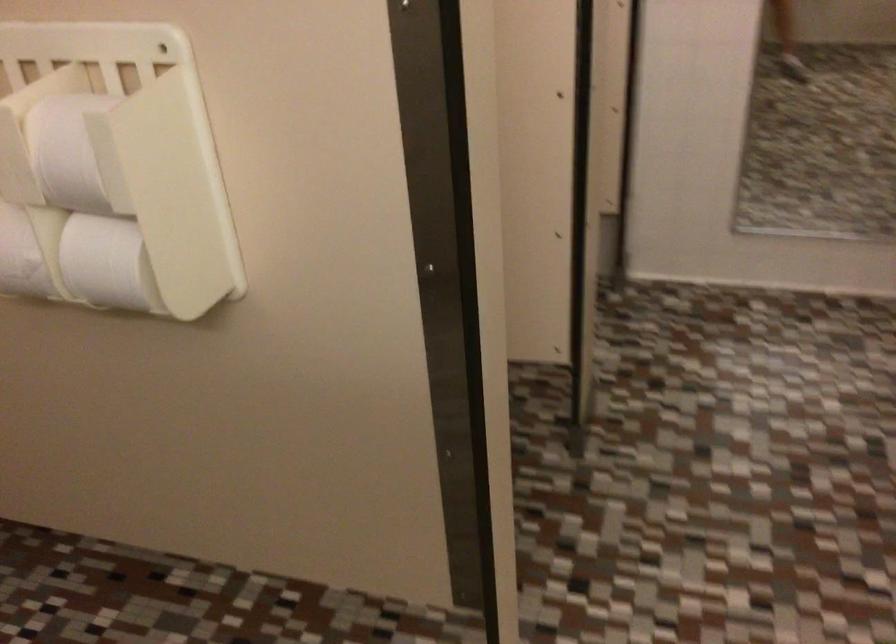
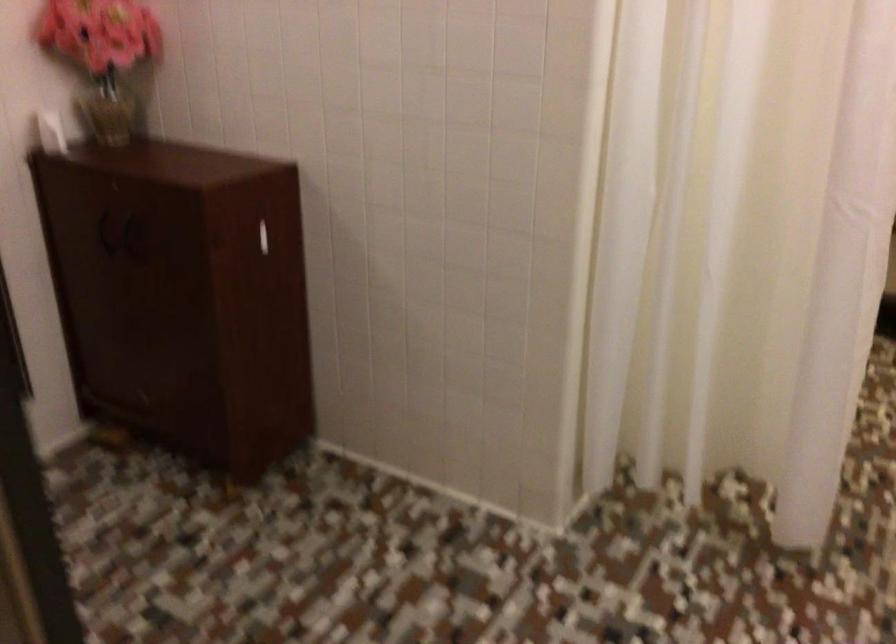
Question: The camera is either moving clockwise (left) or counter-clockwise (right) around the object. The first image is from the beginning of the video and the second image is from the end. Is the camera moving left or right when shooting the video?

Choices:
 (A) Left
 (B) Right

Answer: (A)